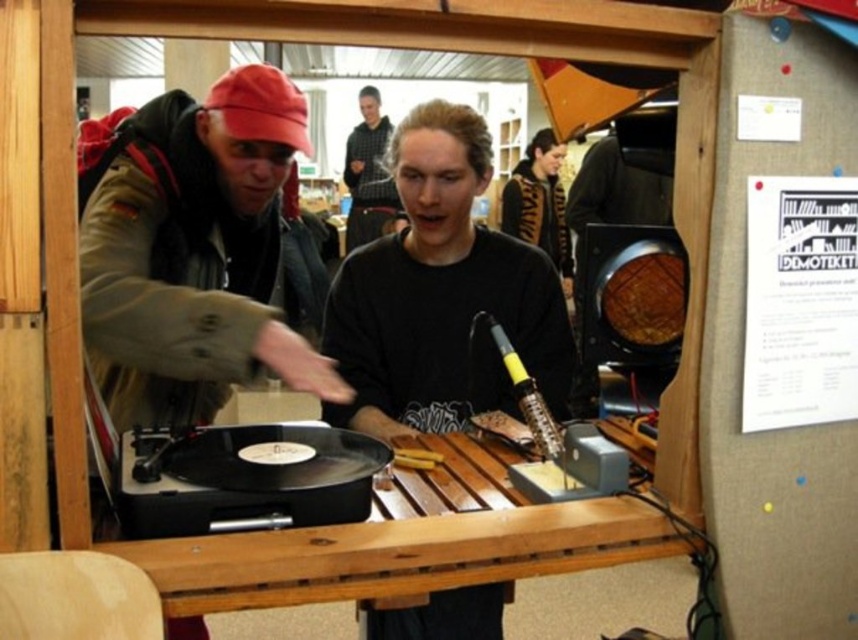
Question: Which point is closer to the camera?

Choices:
 (A) black textured sweater at upper center
 (B) black matte shirt at center
 (C) dark gray hoodie at center

Answer: (B)

Question: In this image, where is black textured sweater at upper center located relative to dark gray hoodie at center?

Choices:
 (A) above
 (B) below

Answer: (B)

Question: Which object is closer to the camera taking this photo?

Choices:
 (A) black textured sweater at upper center
 (B) black matte shirt at center

Answer: (B)

Question: Considering the real-world distances, which object is farthest from the black textured sweater at upper center?

Choices:
 (A) dark gray hoodie at center
 (B) wooden table at center

Answer: (B)

Question: Can you confirm if black textured sweater at upper center is positioned below dark gray hoodie at center?

Choices:
 (A) no
 (B) yes

Answer: (B)

Question: Can you confirm if black matte shirt at center is bigger than wooden table at center?

Choices:
 (A) no
 (B) yes

Answer: (B)